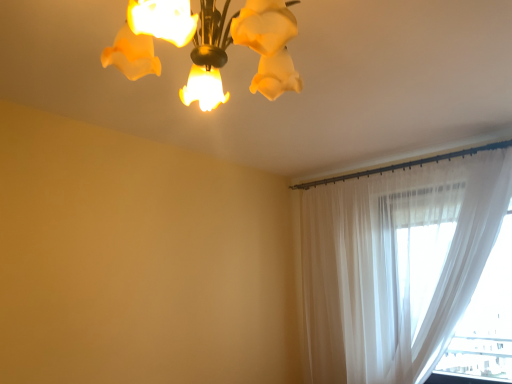
Question: Considering the positions of sheer white curtain at right and matte glass chandelier at upper center in the image, is sheer white curtain at right taller or shorter than matte glass chandelier at upper center?

Choices:
 (A) tall
 (B) short

Answer: (A)

Question: Is sheer white curtain at right bigger or smaller than matte glass chandelier at upper center?

Choices:
 (A) small
 (B) big

Answer: (B)

Question: Does point (321, 360) appear closer or farther from the camera than point (122, 46)?

Choices:
 (A) closer
 (B) farther

Answer: (B)

Question: From the image's perspective, is matte glass chandelier at upper center positioned above or below sheer white curtain at right?

Choices:
 (A) below
 (B) above

Answer: (B)

Question: Is matte glass chandelier at upper center wider or thinner than sheer white curtain at right?

Choices:
 (A) thin
 (B) wide

Answer: (B)

Question: Based on their positions, is matte glass chandelier at upper center located to the left or right of sheer white curtain at right?

Choices:
 (A) right
 (B) left

Answer: (B)

Question: Is matte glass chandelier at upper center inside or outside of sheer white curtain at right?

Choices:
 (A) inside
 (B) outside

Answer: (B)